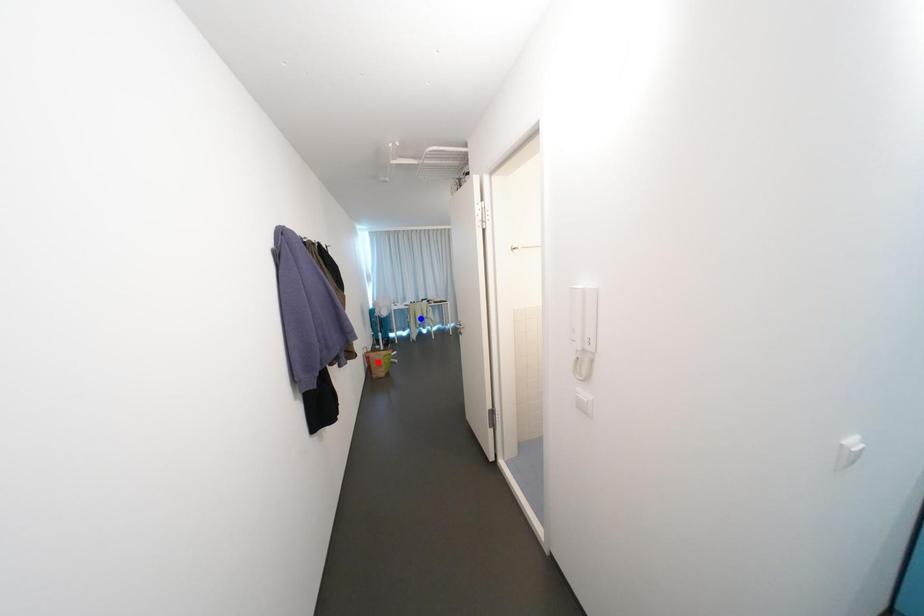
Question: In the image, two points are highlighted. Which point is nearer to the camera? Reply with the corresponding letter.

Choices:
 (A) blue point
 (B) red point

Answer: (B)